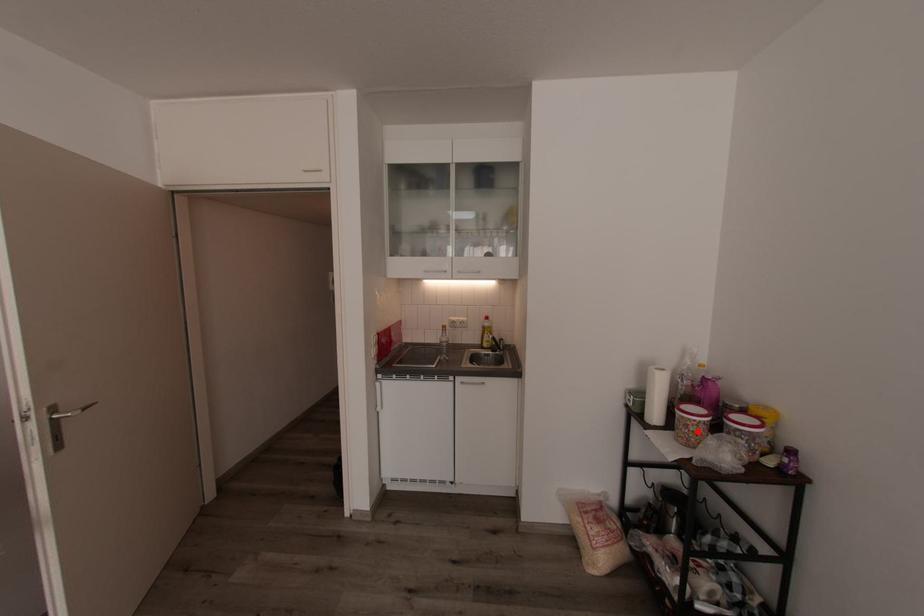
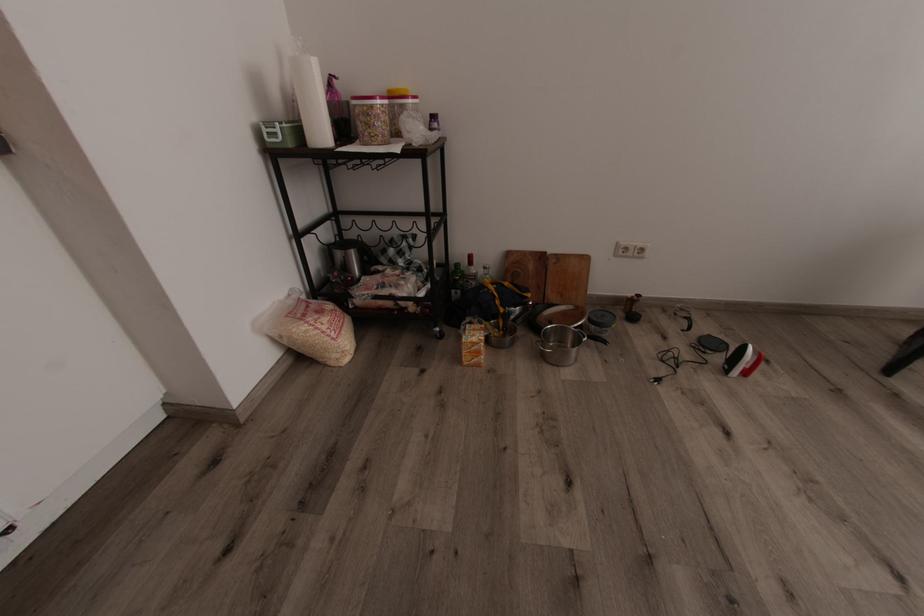
Question: I am providing you with two images of the same scene from different viewpoints. Image1 has a red point marked. In image2, the corresponding 3D location appears at what relative position? Reply with the corresponding letter.

Choices:
 (A) Closer
 (B) Farther

Answer: (A)